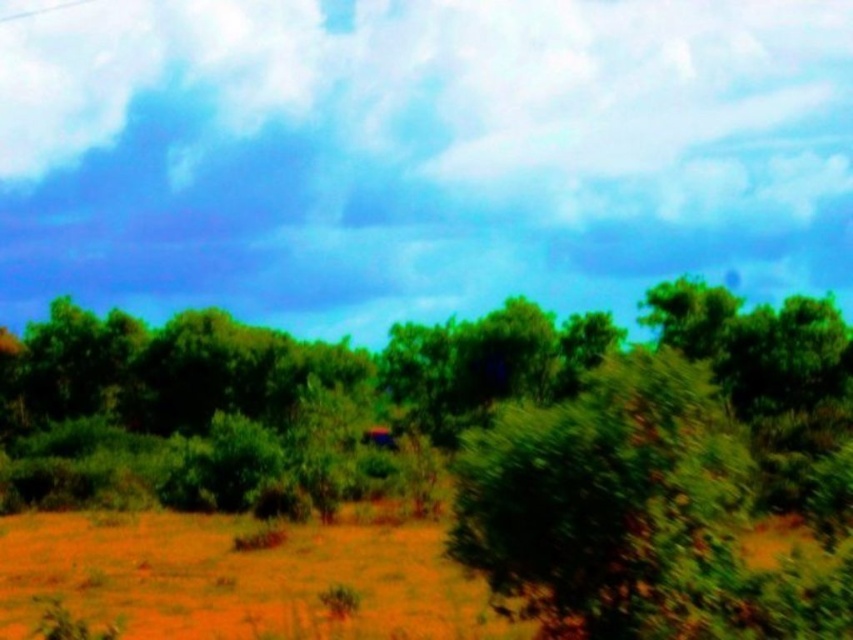
Describe the element at coordinates (480, 444) in the screenshot. I see `green leafy tree at center` at that location.

In the scene shown: Between green leafy tree at center and brown sandy dirt field at lower left, which one has more height?

green leafy tree at center is taller.

What do you see at coordinates (480, 444) in the screenshot?
I see `green leafy tree at center` at bounding box center [480, 444].

Image resolution: width=853 pixels, height=640 pixels. I want to click on green leafy tree at center, so click(480, 444).